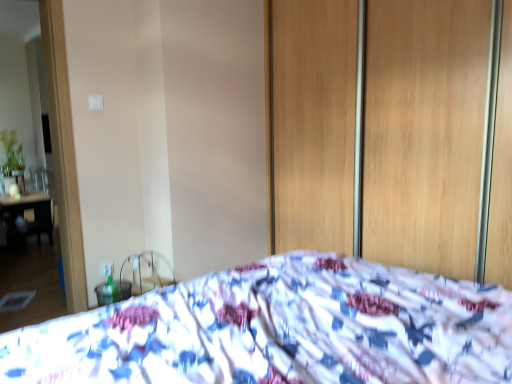
Question: Considering the positions of wooden screen door at center and white printed fabric bed at center in the image, is wooden screen door at center taller or shorter than white printed fabric bed at center?

Choices:
 (A) tall
 (B) short

Answer: (A)

Question: Is wooden screen door at center wider or thinner than white printed fabric bed at center?

Choices:
 (A) wide
 (B) thin

Answer: (B)

Question: Based on their positions, is wooden screen door at center located to the left or right of white printed fabric bed at center?

Choices:
 (A) right
 (B) left

Answer: (A)

Question: Is white printed fabric bed at center inside the boundaries of wooden screen door at center, or outside?

Choices:
 (A) outside
 (B) inside

Answer: (A)

Question: Looking at the image, does white printed fabric bed at center seem bigger or smaller compared to wooden screen door at center?

Choices:
 (A) big
 (B) small

Answer: (A)

Question: In the image, is white printed fabric bed at center on the left side or the right side of wooden screen door at center?

Choices:
 (A) left
 (B) right

Answer: (A)

Question: In terms of height, does white printed fabric bed at center look taller or shorter compared to wooden screen door at center?

Choices:
 (A) tall
 (B) short

Answer: (B)